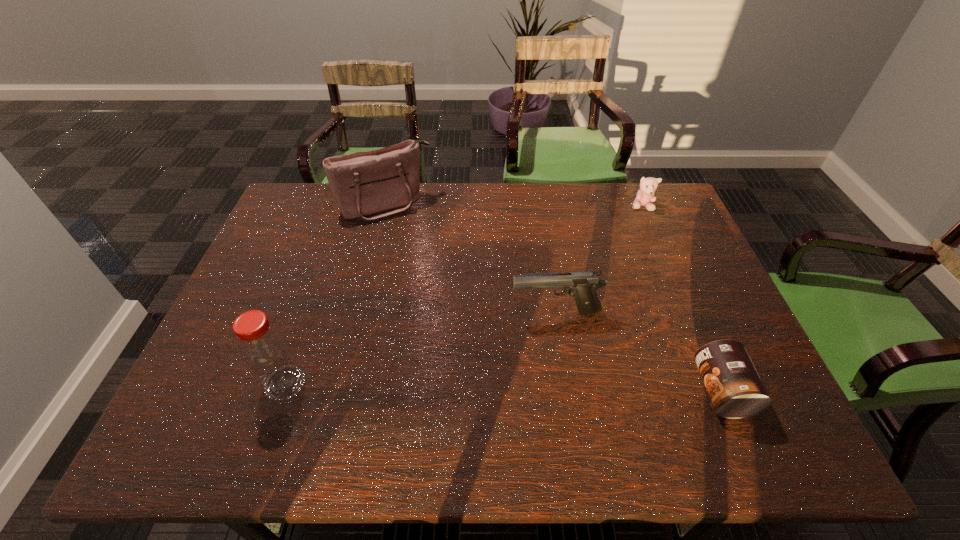
Locate an element on the screen. The width and height of the screenshot is (960, 540). free space located at the face of the teddy bear is located at coordinates (615, 265).

Find the location of a particular element. free space located at the face of the teddy bear is located at coordinates (624, 247).

Where is `free space located at the face of the teddy bear`? The height and width of the screenshot is (540, 960). free space located at the face of the teddy bear is located at coordinates (618, 259).

The width and height of the screenshot is (960, 540). I want to click on vacant space located on the front pocket of the shoulder bag, so click(439, 279).

At what (x,y) coordinates should I click in order to perform the action: click on vacant space situated on the front pocket of the shoulder bag. Please return your answer as a coordinate pair (x, y). Looking at the image, I should click on (420, 249).

The width and height of the screenshot is (960, 540). I want to click on vacant point located 0.340m on the front pocket of the shoulder bag, so [447, 293].

Locate an element on the screen. This screenshot has width=960, height=540. blank space located at the muzzle of the third shortest object is located at coordinates (447, 369).

I want to click on vacant point located 0.070m at the muzzle of the third shortest object, so click(x=501, y=331).

Find the location of a particular element. vacant space located at the muzzle of the third shortest object is located at coordinates (440, 373).

Where is `teddy bear positioned at the far edge`? teddy bear positioned at the far edge is located at coordinates (646, 196).